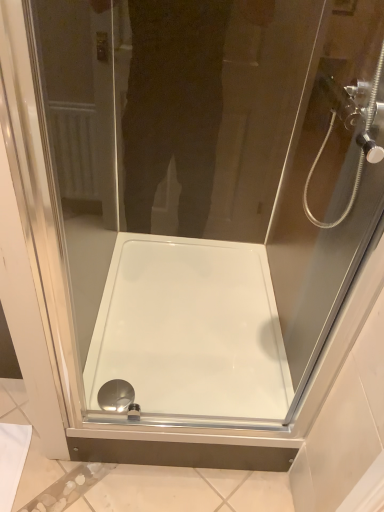
Question: From the image's perspective, is transparent glass shower head at upper right positioned above or below white glossy bath at center?

Choices:
 (A) above
 (B) below

Answer: (A)

Question: In the image, is transparent glass shower head at upper right on the left side or the right side of white glossy bath at center?

Choices:
 (A) right
 (B) left

Answer: (A)

Question: Considering the real-world distances, which object is closest to the polished chrome drain at bottom center?

Choices:
 (A) white glossy bath at center
 (B) transparent glass shower head at upper right

Answer: (A)

Question: Estimate the real-world distances between objects in this image. Which object is closer to the transparent glass shower head at upper right?

Choices:
 (A) white glossy bath at center
 (B) polished chrome drain at bottom center

Answer: (A)